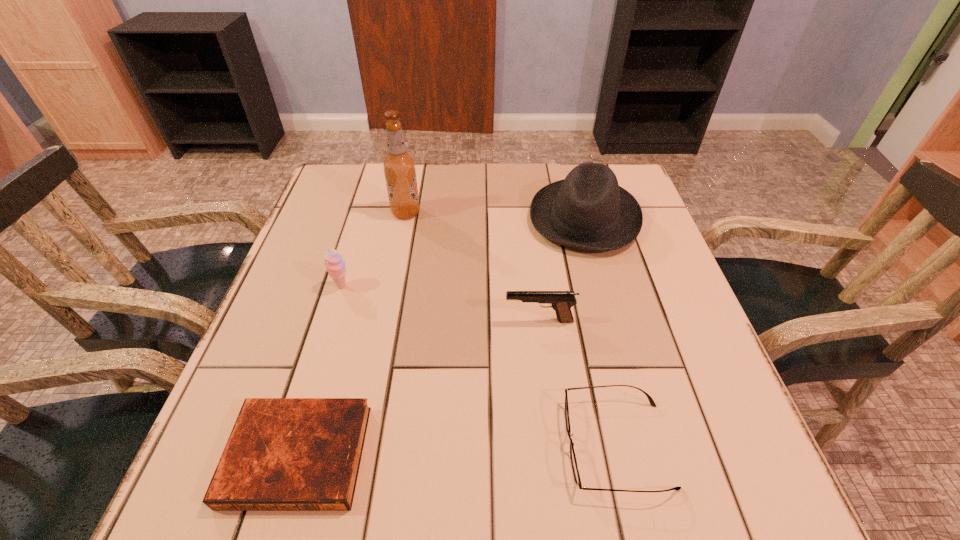
Image resolution: width=960 pixels, height=540 pixels. What are the coordinates of `vacant space at the right edge` in the screenshot? It's located at (648, 280).

What are the coordinates of `free region at the far right corner of the desktop` in the screenshot? It's located at (622, 183).

You are a GUI agent. You are given a task and a screenshot of the screen. Output one action in this format:
    pyautogui.click(x=<x>, y=<y>)
    Task: Click on the vacant space that is in between the pistol and the second shortest object
    Image resolution: width=960 pixels, height=540 pixels.
    Given the screenshot: What is the action you would take?
    pyautogui.click(x=578, y=383)

Locate an element on the screen. The image size is (960, 540). free space that is in between the spectacles and the fourth nearest object is located at coordinates (479, 366).

This screenshot has height=540, width=960. What are the coordinates of `free space between the fifth tallest object and the fourth shortest object` in the screenshot? It's located at (479, 366).

Where is `free point between the fourth shortest object and the spectacles`? The height and width of the screenshot is (540, 960). free point between the fourth shortest object and the spectacles is located at coordinates (479, 366).

This screenshot has width=960, height=540. I want to click on vacant area between the pistol and the fourth nearest object, so click(x=441, y=303).

At what (x,y) coordinates should I click in order to perform the action: click on free space between the Bible and the fedora. Please return your answer as a coordinate pair (x, y). The width and height of the screenshot is (960, 540). Looking at the image, I should click on (441, 336).

The image size is (960, 540). What are the coordinates of `unoccupied area between the fedora and the Bible` in the screenshot? It's located at (441, 336).

Locate an element on the screen. The image size is (960, 540). vacant area that lies between the fedora and the fourth farthest object is located at coordinates (562, 269).